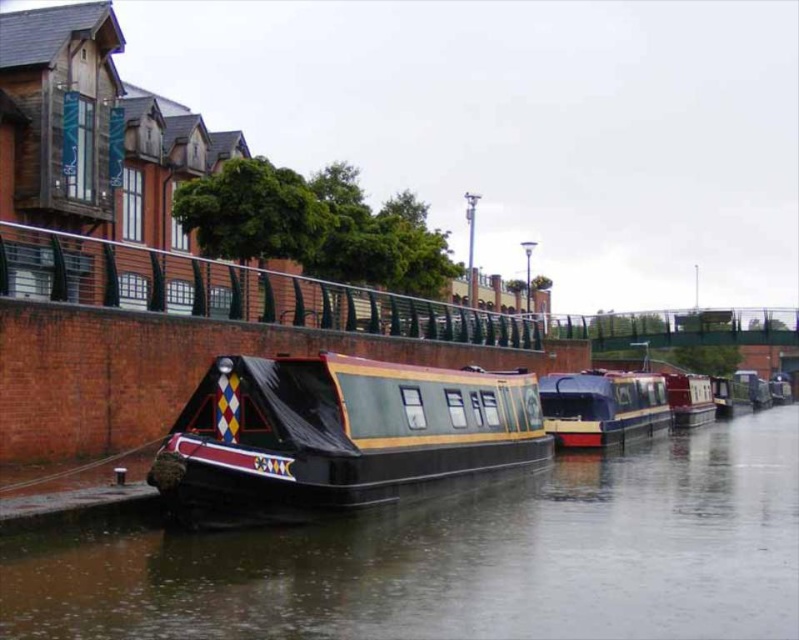
Question: Among these objects, which one is nearest to the camera?

Choices:
 (A) polished wood boat at center
 (B) black rubber boat at center

Answer: (B)

Question: Is black rubber boat at center below red glossy canal boat at center?

Choices:
 (A) yes
 (B) no

Answer: (A)

Question: Can you confirm if shiny blue and yellow boat at center is positioned to the left of red glossy canal boat at center?

Choices:
 (A) no
 (B) yes

Answer: (B)

Question: Which of the following is the farthest from the observer?

Choices:
 (A) shiny blue and yellow boat at center
 (B) polished wood boat at center

Answer: (A)

Question: Which point is farther to the camera?

Choices:
 (A) (666, 384)
 (B) (487, 502)
 (C) (574, 440)

Answer: (A)

Question: Does black rubber boat at center have a smaller size compared to red glossy canal boat at center?

Choices:
 (A) no
 (B) yes

Answer: (A)